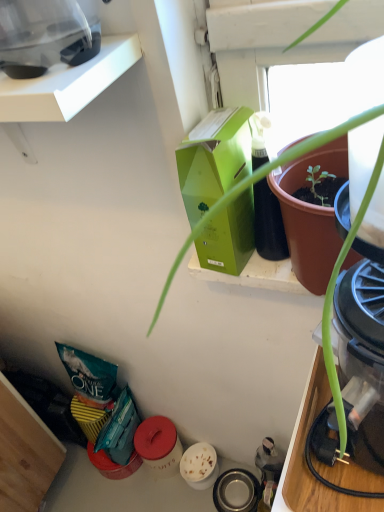
From the picture: What is the approximate width of transparent plastic blender at upper left, placed as the 1th appliance when sorted from left to right?

It is 23.01 centimeters.

What do you see at coordinates (236, 490) in the screenshot? I see `metallic stainless steel bowl at lower center, which is the second appliance in front-to-back order` at bounding box center [236, 490].

I want to click on transparent plastic blender at upper left, the first appliance from the top, so click(x=43, y=36).

How distant is transparent plastic blender at upper left, the second appliance in the bottom-to-top sequence, from metallic stainless steel bowl at lower center, arranged as the first appliance when viewed from the right?

→ transparent plastic blender at upper left, the second appliance in the bottom-to-top sequence, and metallic stainless steel bowl at lower center, arranged as the first appliance when viewed from the right, are 1.23 meters apart from each other.

Is transparent plastic blender at upper left, the second appliance in the bottom-to-top sequence, directly adjacent to metallic stainless steel bowl at lower center, arranged as the first appliance when viewed from the right?

No, transparent plastic blender at upper left, the second appliance in the bottom-to-top sequence, is not beside metallic stainless steel bowl at lower center, arranged as the first appliance when viewed from the right.

Based on the photo, in the image, is transparent plastic blender at upper left, placed as the 1th appliance when sorted from left to right, on the left side or the right side of metallic stainless steel bowl at lower center, which is the second appliance in front-to-back order?

transparent plastic blender at upper left, placed as the 1th appliance when sorted from left to right, is positioned on metallic stainless steel bowl at lower center, which is the second appliance in front-to-back order,'s left side.

Based on their sizes in the image, would you say transparent plastic blender at upper left, which ranks as the second appliance in back-to-front order, is bigger or smaller than metallic stainless steel bowl at lower center, the 2th appliance positioned from the left?

Considering their sizes, transparent plastic blender at upper left, which ranks as the second appliance in back-to-front order, takes up more space than metallic stainless steel bowl at lower center, the 2th appliance positioned from the left.

Does metallic stainless steel bowl at lower center, which is the second appliance in front-to-back order, have a larger size compared to green matte box at upper center?

No, metallic stainless steel bowl at lower center, which is the second appliance in front-to-back order, is not bigger than green matte box at upper center.

From the picture: Which is more to the right, metallic stainless steel bowl at lower center, the 2th appliance positioned from the left, or green matte box at upper center?

metallic stainless steel bowl at lower center, the 2th appliance positioned from the left.

Is green matte box at upper center completely or partially inside metallic stainless steel bowl at lower center, the 2th appliance positioned from the left?

No.

Based on the photo, measure the distance from metallic stainless steel bowl at lower center, placed as the first appliance when sorted from bottom to top, to green matte box at upper center.

metallic stainless steel bowl at lower center, placed as the first appliance when sorted from bottom to top, and green matte box at upper center are 35.45 inches apart.

Is the depth of green matte box at upper center greater than that of transparent plastic blender at upper left, which is the first appliance from front to back?

Yes.

From the image's perspective, is green matte box at upper center on transparent plastic blender at upper left, which is counted as the 2th appliance, starting from the right?

Incorrect, from the image's perspective, green matte box at upper center is lower than transparent plastic blender at upper left, which is counted as the 2th appliance, starting from the right.

Is green matte box at upper center positioned beyond the bounds of transparent plastic blender at upper left, which ranks as the second appliance in back-to-front order?

That's correct, green matte box at upper center is outside of transparent plastic blender at upper left, which ranks as the second appliance in back-to-front order.

From a real-world perspective, is transparent plastic blender at upper left, which is counted as the 2th appliance, starting from the right, positioned under green matte box at upper center based on gravity?

No, from a real-world perspective, transparent plastic blender at upper left, which is counted as the 2th appliance, starting from the right, is not below green matte box at upper center.

Is transparent plastic blender at upper left, which ranks as the second appliance in back-to-front order, far away from green matte box at upper center?

transparent plastic blender at upper left, which ranks as the second appliance in back-to-front order, is near green matte box at upper center, not far away.

How far apart are transparent plastic blender at upper left, the first appliance from the top, and green matte box at upper center?

The distance of transparent plastic blender at upper left, the first appliance from the top, from green matte box at upper center is 9.79 inches.

Is green matte box at upper center not inside metallic stainless steel bowl at lower center, which appears as the first appliance when viewed from the back?

green matte box at upper center lies outside metallic stainless steel bowl at lower center, which appears as the first appliance when viewed from the back,'s area.

Considering the sizes of objects green matte box at upper center and metallic stainless steel bowl at lower center, arranged as the first appliance when viewed from the right, in the image provided, who is thinner, green matte box at upper center or metallic stainless steel bowl at lower center, arranged as the first appliance when viewed from the right,?

Thinner between the two is green matte box at upper center.

From a real-world perspective, is green matte box at upper center physically below metallic stainless steel bowl at lower center, the second appliance from the top?

No, from a real-world perspective, green matte box at upper center is not below metallic stainless steel bowl at lower center, the second appliance from the top.

Could you tell me if green matte box at upper center is facing metallic stainless steel bowl at lower center, the 2th appliance positioned from the left?

No, green matte box at upper center is not aimed at metallic stainless steel bowl at lower center, the 2th appliance positioned from the left.

Considering the sizes of objects metallic stainless steel bowl at lower center, the second appliance from the top, and transparent plastic blender at upper left, which ranks as the second appliance in back-to-front order, in the image provided, who is bigger, metallic stainless steel bowl at lower center, the second appliance from the top, or transparent plastic blender at upper left, which ranks as the second appliance in back-to-front order,?

With larger size is transparent plastic blender at upper left, which ranks as the second appliance in back-to-front order.

Is metallic stainless steel bowl at lower center, arranged as the first appliance when viewed from the right, to the right of transparent plastic blender at upper left, which is counted as the 2th appliance, starting from the right, from the viewer's perspective?

Correct, you'll find metallic stainless steel bowl at lower center, arranged as the first appliance when viewed from the right, to the right of transparent plastic blender at upper left, which is counted as the 2th appliance, starting from the right.

How different are the orientations of metallic stainless steel bowl at lower center, which is the second appliance in front-to-back order, and transparent plastic blender at upper left, which is the first appliance from front to back, in degrees?

The angular difference between metallic stainless steel bowl at lower center, which is the second appliance in front-to-back order, and transparent plastic blender at upper left, which is the first appliance from front to back, is 95.2 degrees.

Is metallic stainless steel bowl at lower center, which appears as the first appliance when viewed from the back, situated inside transparent plastic blender at upper left, the second appliance in the bottom-to-top sequence, or outside?

metallic stainless steel bowl at lower center, which appears as the first appliance when viewed from the back, is located beyond the bounds of transparent plastic blender at upper left, the second appliance in the bottom-to-top sequence.

Locate an element on the screen. appliance below the transparent plastic blender at upper left, the second appliance in the bottom-to-top sequence (from the image's perspective) is located at coordinates (236, 490).

I want to click on appliance below the green matte box at upper center (from a real-world perspective), so click(236, 490).

Looking at the image, which one is located further to transparent plastic blender at upper left, which is the first appliance from front to back, green matte box at upper center or metallic stainless steel bowl at lower center, arranged as the first appliance when viewed from the right?

metallic stainless steel bowl at lower center, arranged as the first appliance when viewed from the right, is positioned further to the anchor transparent plastic blender at upper left, which is the first appliance from front to back.

From the image, which object appears to be farther from metallic stainless steel bowl at lower center, placed as the first appliance when sorted from bottom to top, green matte box at upper center or transparent plastic blender at upper left, the first appliance from the top?

transparent plastic blender at upper left, the first appliance from the top, is positioned further to the anchor metallic stainless steel bowl at lower center, placed as the first appliance when sorted from bottom to top.

When comparing their distances from metallic stainless steel bowl at lower center, which is the second appliance in front-to-back order, does transparent plastic blender at upper left, placed as the 1th appliance when sorted from left to right, or green matte box at upper center seem further?

The object further to metallic stainless steel bowl at lower center, which is the second appliance in front-to-back order, is transparent plastic blender at upper left, placed as the 1th appliance when sorted from left to right.

Consider the image. Looking at the image, which one is located closer to green matte box at upper center, metallic stainless steel bowl at lower center, placed as the first appliance when sorted from bottom to top, or transparent plastic blender at upper left, which ranks as the second appliance in back-to-front order?

Based on the image, transparent plastic blender at upper left, which ranks as the second appliance in back-to-front order, appears to be nearer to green matte box at upper center.

In the scene shown: When comparing their distances from transparent plastic blender at upper left, the first appliance from the top, does metallic stainless steel bowl at lower center, the second appliance from the top, or green matte box at upper center seem closer?

Based on the image, green matte box at upper center appears to be nearer to transparent plastic blender at upper left, the first appliance from the top.

Which object lies further to the anchor point green matte box at upper center, transparent plastic blender at upper left, which is counted as the 2th appliance, starting from the right, or metallic stainless steel bowl at lower center, which is the second appliance in front-to-back order?

The object further to green matte box at upper center is metallic stainless steel bowl at lower center, which is the second appliance in front-to-back order.

Where is `box between transparent plastic blender at upper left, which is the first appliance from front to back, and metallic stainless steel bowl at lower center, which is the second appliance in front-to-back order, in the vertical direction`? box between transparent plastic blender at upper left, which is the first appliance from front to back, and metallic stainless steel bowl at lower center, which is the second appliance in front-to-back order, in the vertical direction is located at coordinates (213, 159).